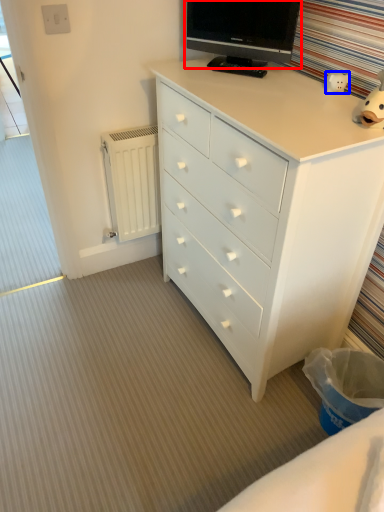
Question: Which object appears closest to the camera in this image, television (highlighted by a red box) or toy (highlighted by a blue box)?

Choices:
 (A) television
 (B) toy

Answer: (B)